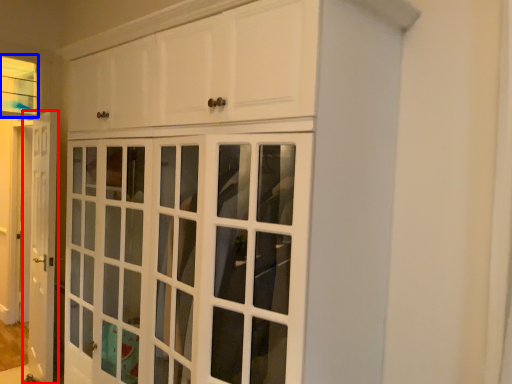
Question: Which object appears closest to the camera in this image, door (highlighted by a red box) or window (highlighted by a blue box)?

Choices:
 (A) door
 (B) window

Answer: (A)